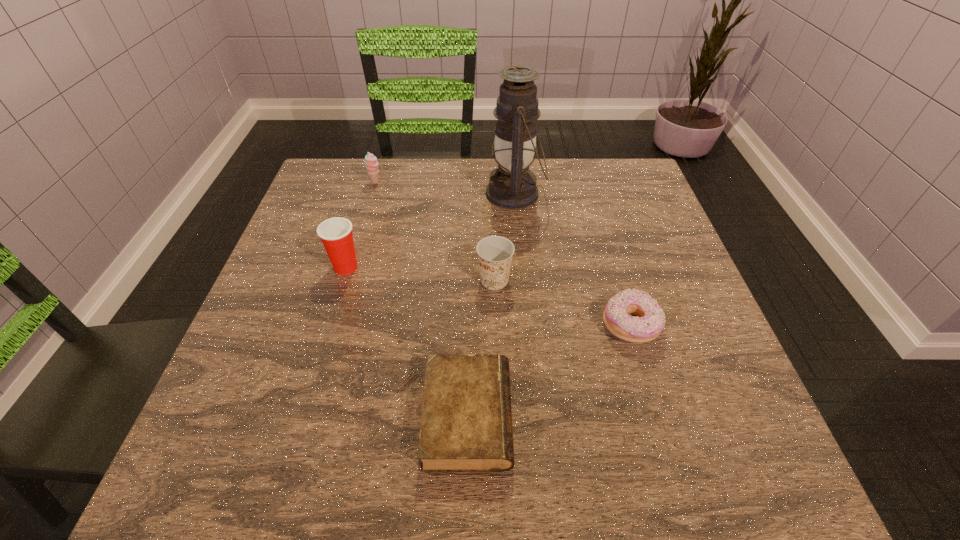
The image size is (960, 540). In order to click on vacant region that satisfies the following two spatial constraints: 1. on the front side of the shorter Dixie cup; 2. on the right side of the fifth shortest object in this screenshot , I will do `click(342, 280)`.